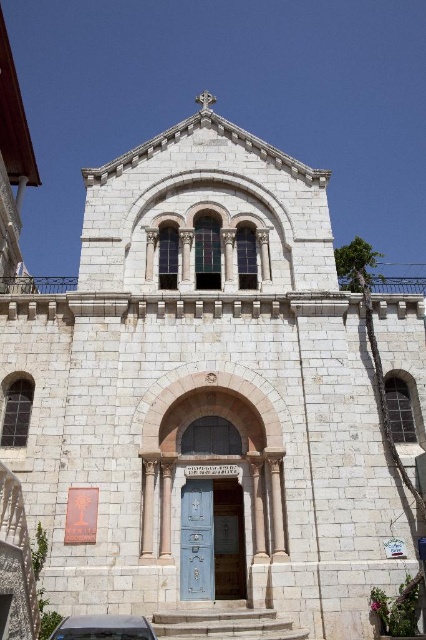
Question: Is blue painted wood door at center smaller than metallic silver car at lower center?

Choices:
 (A) yes
 (B) no

Answer: (A)

Question: Which object is closer to the camera taking this photo?

Choices:
 (A) blue painted wood door at center
 (B) metallic silver car at lower center

Answer: (B)

Question: Does blue painted wood door at center appear on the right side of metallic silver car at lower center?

Choices:
 (A) yes
 (B) no

Answer: (A)

Question: Which point is closer to the camera?

Choices:
 (A) (149, 628)
 (B) (190, 541)

Answer: (A)

Question: Can you confirm if blue painted wood door at center is positioned to the right of metallic silver car at lower center?

Choices:
 (A) yes
 (B) no

Answer: (A)